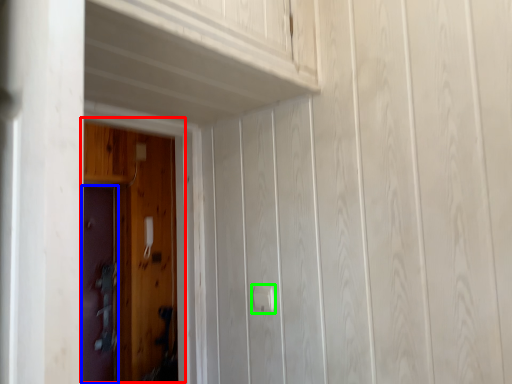
Question: Which object is the closest to the door (highlighted by a red box)? Choose among these: door (highlighted by a blue box) or door handle (highlighted by a green box).

Choices:
 (A) door
 (B) door handle

Answer: (A)